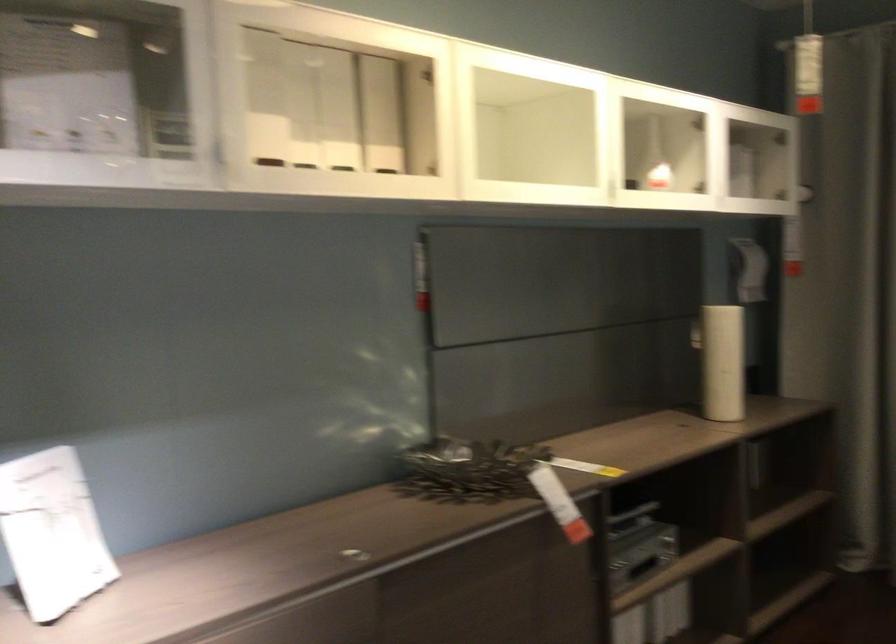
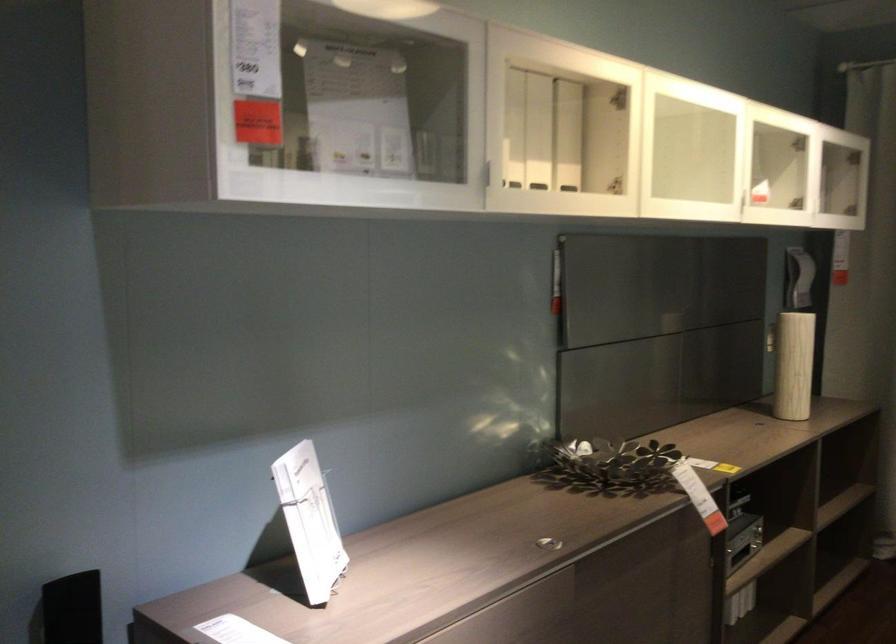
Locate, in the second image, the point that corresponds to the point at 382,114 in the first image.

(567, 135)